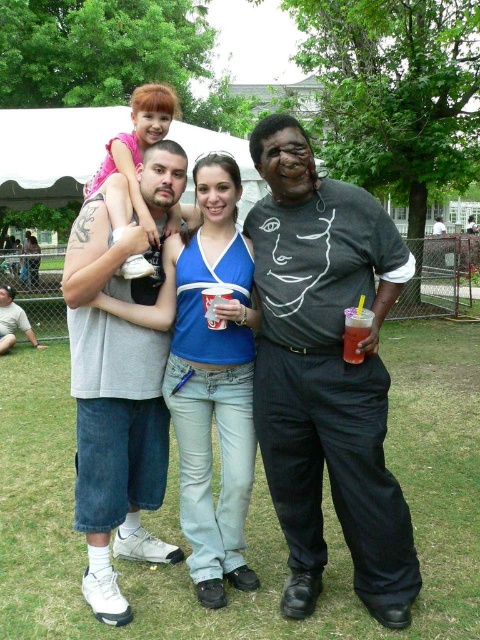
Question: Which point appears farthest from the camera in this image?

Choices:
 (A) (344, 333)
 (B) (151, 225)
 (C) (338, 465)

Answer: (B)

Question: Considering the relative positions of gray cotton t-shirt at center and brushed metal water at bottle left in the image provided, where is gray cotton t-shirt at center located with respect to brushed metal water at bottle left?

Choices:
 (A) right
 (B) left

Answer: (A)

Question: Can you confirm if matte blue tank top at center is bigger than blue denim jeans at center?

Choices:
 (A) yes
 (B) no

Answer: (A)

Question: Which point appears closest to the camera in this image?

Choices:
 (A) (300, 472)
 (B) (126, 208)
 (C) (31, 269)
 (D) (147, 172)

Answer: (A)

Question: Among these objects, which one is farthest from the camera?

Choices:
 (A) matte pink shirt at upper left
 (B) translucent plastic cup at center

Answer: (A)

Question: Can you confirm if matte blue tank top at center is positioned above blue denim jeans at center?

Choices:
 (A) no
 (B) yes

Answer: (B)